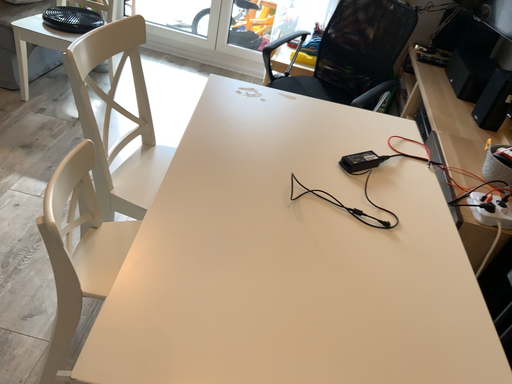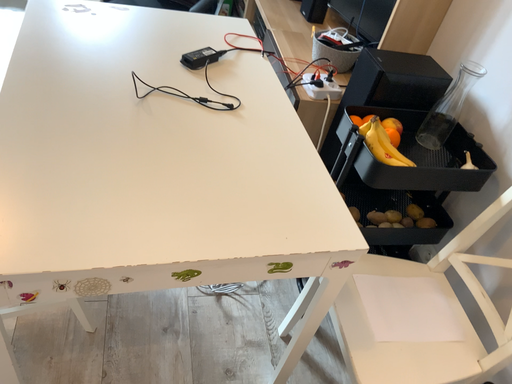
Question: How did the camera likely rotate when shooting the video?

Choices:
 (A) rotated left
 (B) rotated right

Answer: (B)